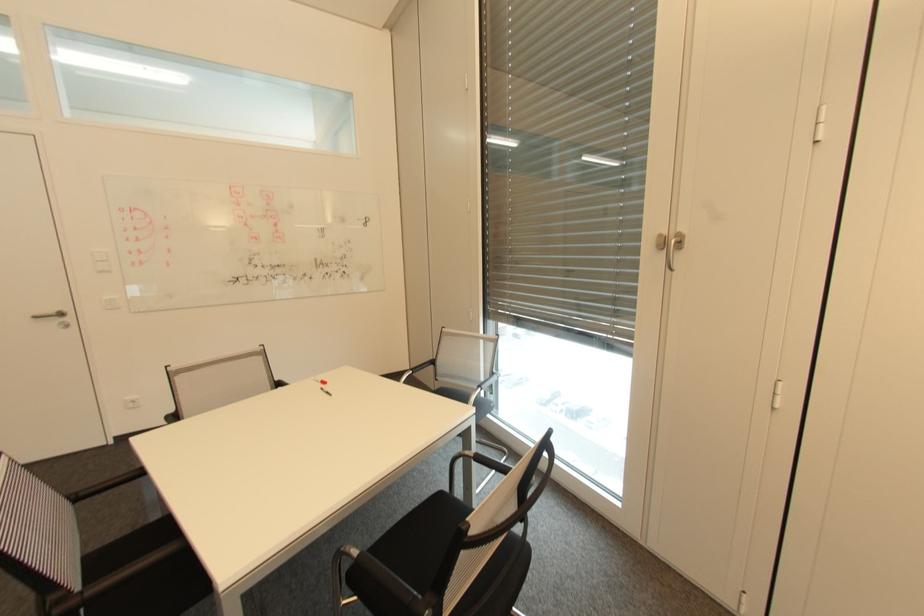
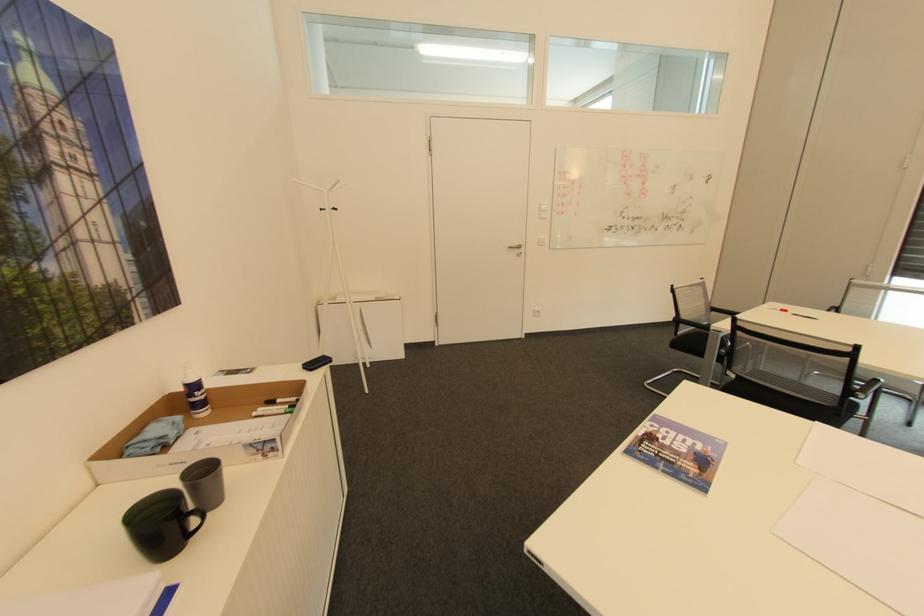
In the scene shown: What movement of the cameraman would produce the second image?

The cameraman moved toward left, backward.